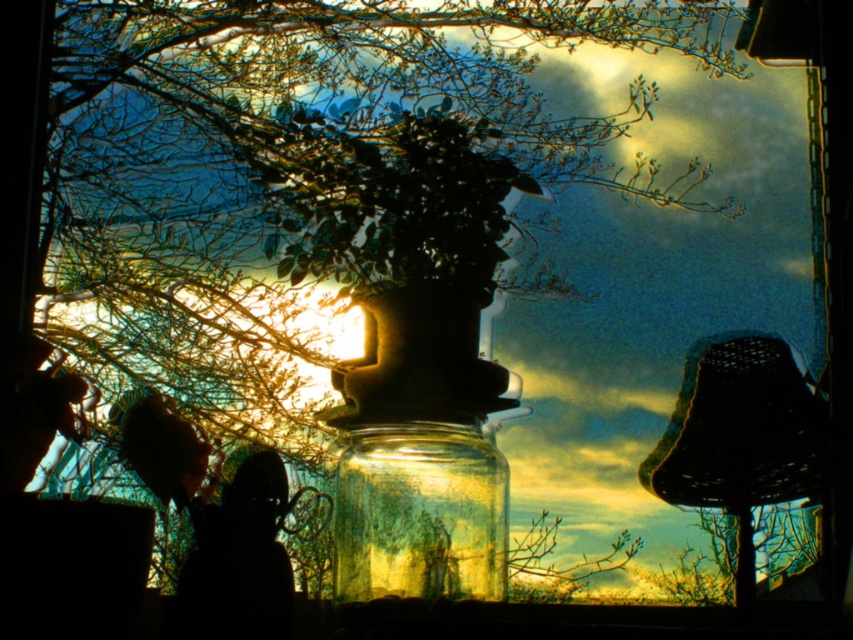
You are standing in front of the window and see two points marked in the scene. The first point is at coordinates point (485,477) and the second point is at point (779,497). Which point is closer to you?

Point (485,477) is closer to the viewer than point (779,497).

You are an interior designer planning to place a decorative item between the transparent glass jar at center and the black woven lampshade at right. Considering their widths, which item should the new item be placed closer to?

The transparent glass jar at center has a lesser width compared to the black woven lampshade at right, so the new decorative item should be placed closer to the transparent glass jar at center to maintain balance.